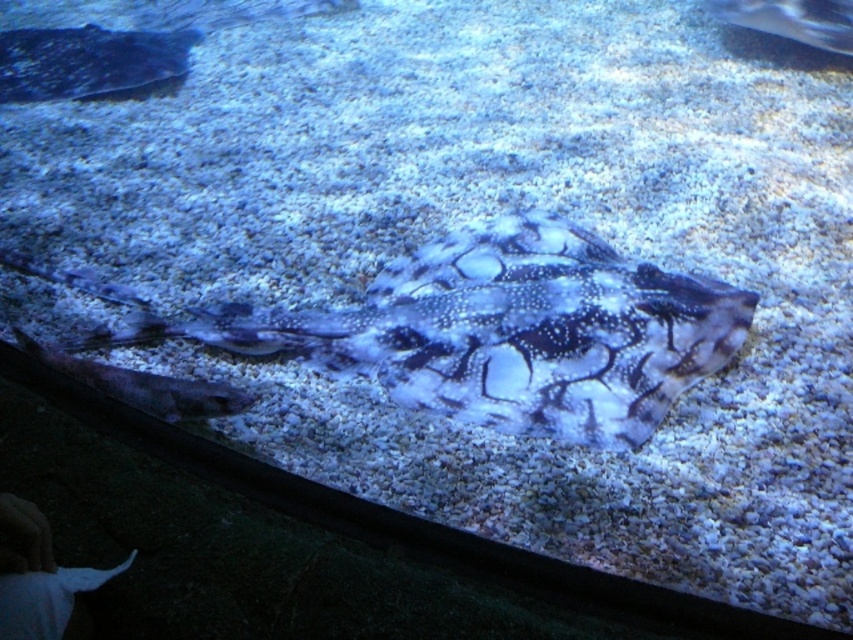
You are an aquarium guide explaining the stingrays to a visitor. You point out the two speckled skin ray at center and the speckled skin ray at upper right. Which one do you think is bigger in width?

The speckled skin ray at center is wider than the speckled skin ray at upper right.

You are an underwater photographer trying to capture a closeup shot of the speckled skin ray at center and the speckled skin fish at center. Since your camera can only focus on one subject at a time, which one should you choose if you want to ensure the subject fills the frame without cropping?

The speckled skin ray at center is bigger than the speckled skin fish at center, so you should choose the speckled skin ray at center to fill the frame without cropping.